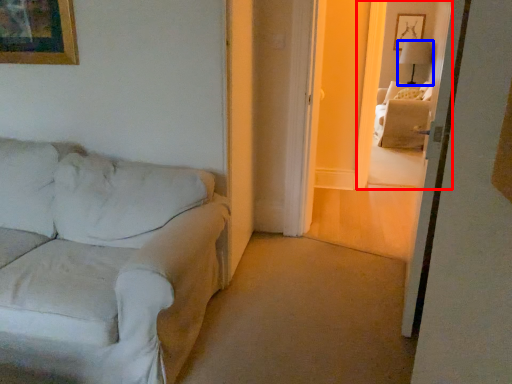
Question: Which of the following is the closest to the observer, window (highlighted by a red box) or lamp (highlighted by a blue box)?

Choices:
 (A) window
 (B) lamp

Answer: (A)